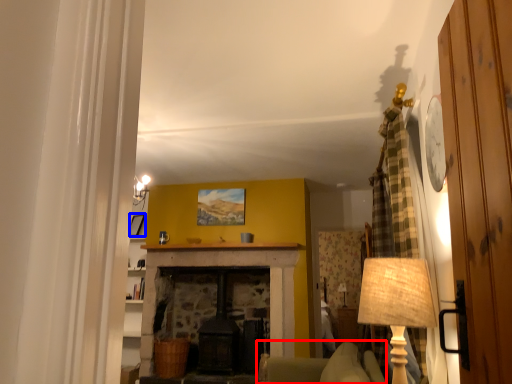
Question: Which of the following is the closest to the observer, armchair (highlighted by a red box) or picture frame (highlighted by a blue box)?

Choices:
 (A) armchair
 (B) picture frame

Answer: (A)